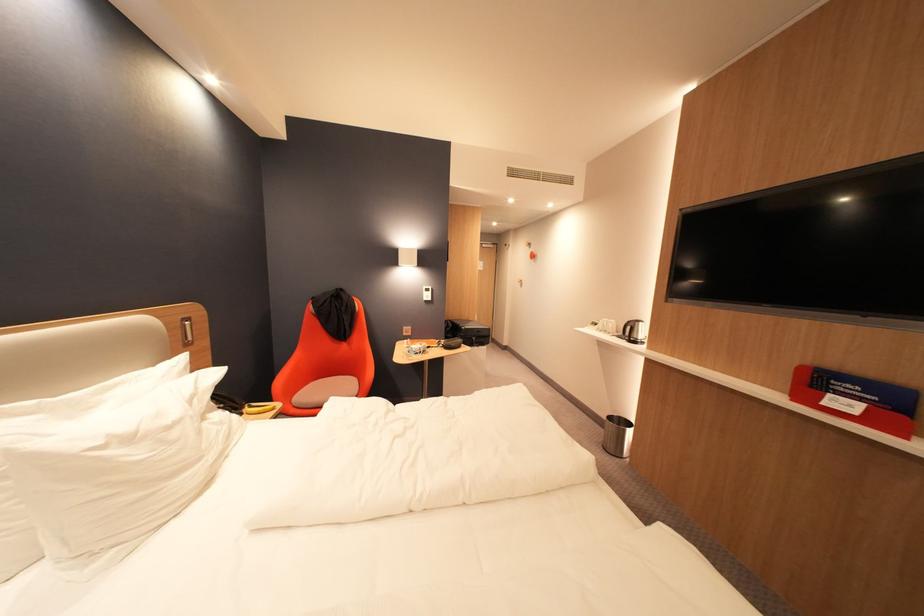
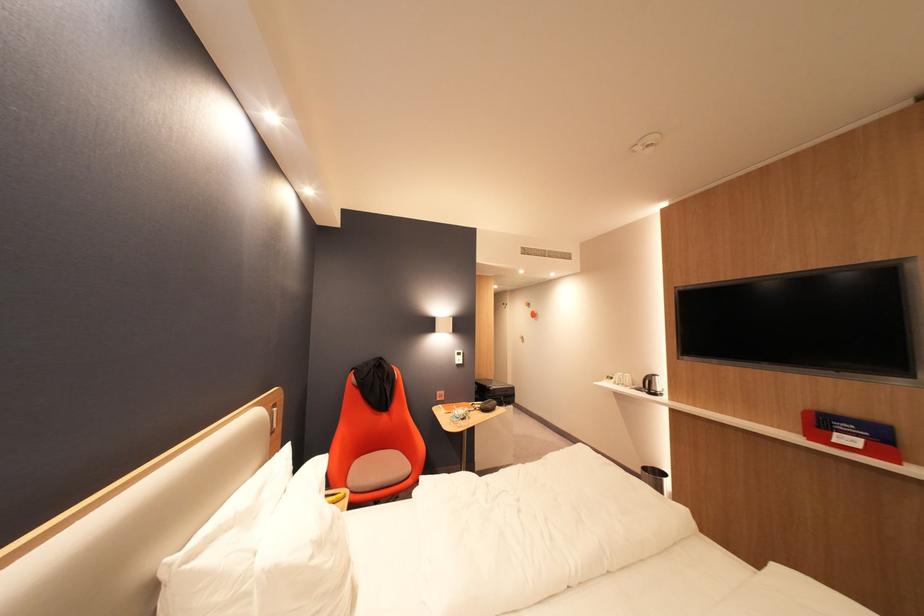
Where in the second image is the point corresponding to the point at 614,419 from the first image?

(648, 471)